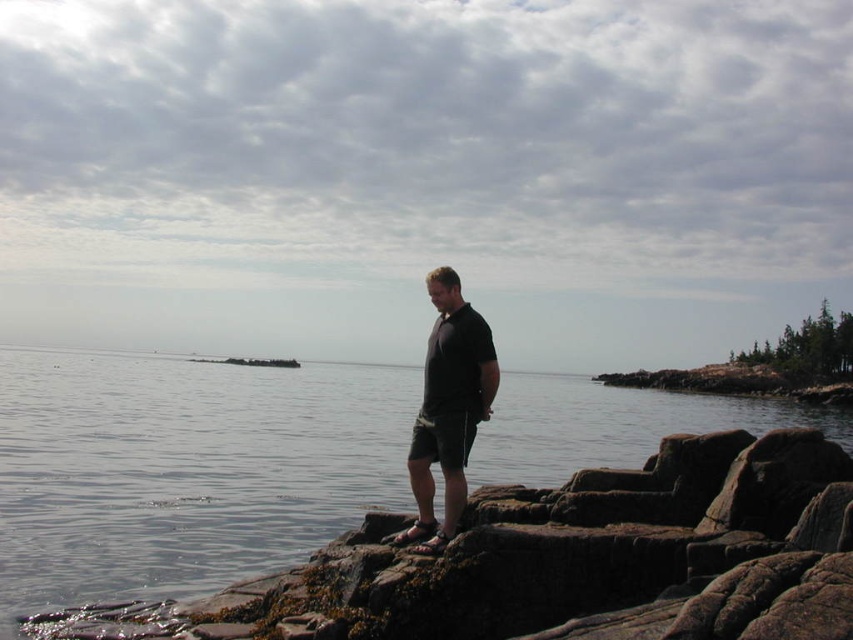
You are a photographer standing on the rocky outcrop. You want to capture a photo of the clear water at center without the black matte shorts at center appearing in the frame. Is this possible based on their positions?

The clear water at center is in front of the black matte shorts at center, so it is not possible to capture the clear water at center without the black matte shorts at center appearing in the frame since they are positioned behind it.

You are a photographer planning to capture the clear water at center and the black matte shorts at center in a single frame. Your camera has a maximum focus range of 70 meters. Will you be able to include both objects in the same photo without moving closer?

The clear water at center and black matte shorts at center are 75.05 meters apart. Since the distance between them exceeds the camera maximum focus range of 70 meters, you won not be able to capture both in the same frame without moving closer.